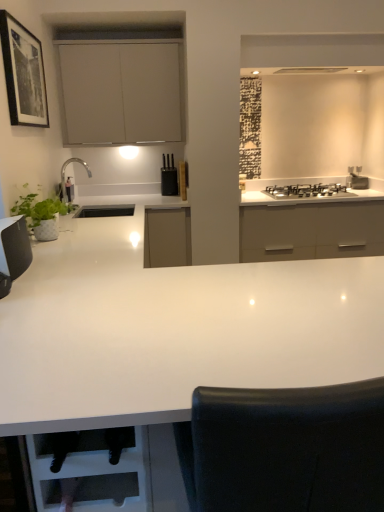
Question: Considering the positions of matte white cabinet at upper center and satin silver stove at upper right in the image, is matte white cabinet at upper center wider or thinner than satin silver stove at upper right?

Choices:
 (A) thin
 (B) wide

Answer: (B)

Question: In terms of size, does matte white cabinet at upper center appear bigger or smaller than satin silver stove at upper right?

Choices:
 (A) small
 (B) big

Answer: (B)

Question: Estimate the real-world distances between objects in this image. Which object is farther from the satin silver stove at upper right?

Choices:
 (A) matte white cabinet at upper center
 (B) white glossy countertop at center
 (C) black matte picture frame at upper left
 (D) green matte plant at left
 (E) black matte knife block at upper center

Answer: (B)

Question: Based on their relative distances, which object is nearer to the white glossy countertop at center?

Choices:
 (A) green matte plant at left
 (B) black glass gas stove at upper right
 (C) matte white cabinet at upper center
 (D) black matte knife block at upper center
 (E) black matte picture frame at upper left

Answer: (A)